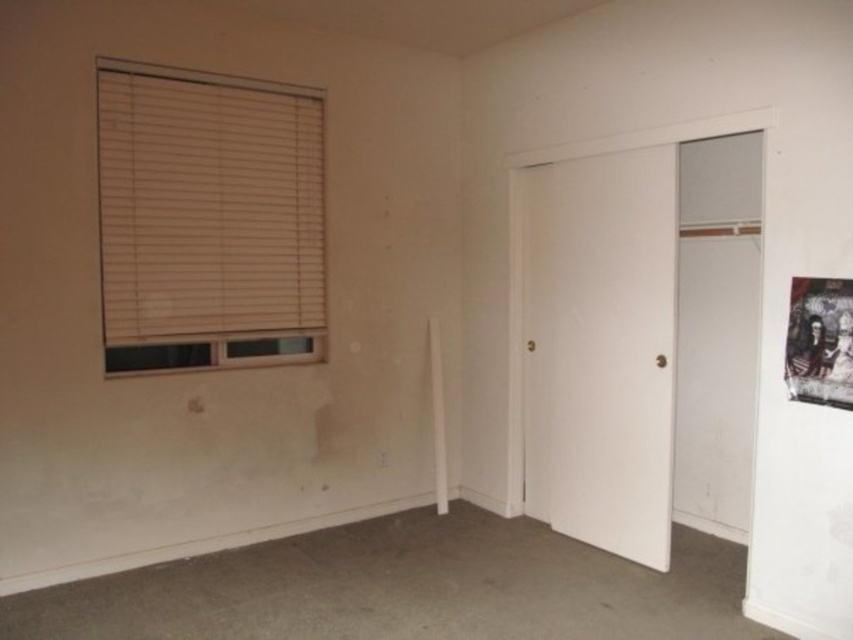
You are standing in the room and want to locate the point marked at coordinates (207, 220). According to the scene description, where exactly is this point located?

The point marked at coordinates (207, 220) is located on the beige wood blinds at upper left.

You are standing in the room depicted in the image. If you face the beige wood blinds at upper left, which direction would you be facing?

The beige wood blinds at upper left are located at coordinates 0.344 on the x and 0.245 on the y axis, so facing them would mean facing the upper left direction of the room.

You are an interior designer planning to hang a new piece of artwork in this room. You have two options to choose from. The first option is the beige wood blinds at upper left, and the second is the dark textured poster at upper right. Which of these two items takes up more visual space in the room?

The beige wood blinds at upper left takes up more visual space in the room than the dark textured poster at upper right because the beige wood blinds at upper left is bigger than the dark textured poster at upper right.